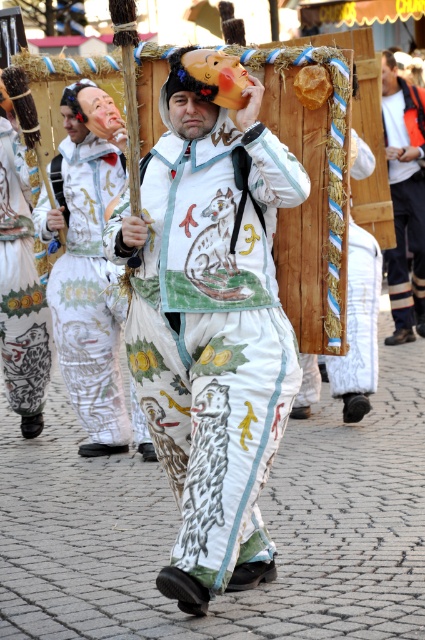
Question: Does orange reflective jacket at upper right appear over matte yellow mask at center?

Choices:
 (A) yes
 (B) no

Answer: (A)

Question: Which of the following is the closest to the observer?

Choices:
 (A) matte yellow mask at center
 (B) matte brown mask at upper center
 (C) matte plastic mask at upper center

Answer: (A)

Question: Among these objects, which one is farthest from the camera?

Choices:
 (A) matte brown mask at upper center
 (B) matte yellow mask at center
 (C) matte plastic mask at upper center

Answer: (A)

Question: Does white painted fabric costume at center have a smaller size compared to matte plastic mask at upper center?

Choices:
 (A) yes
 (B) no

Answer: (B)

Question: Is white painted fabric costume at center positioned in front of white painted fabric mask at center?

Choices:
 (A) yes
 (B) no

Answer: (A)

Question: Estimate the real-world distances between objects in this image. Which object is closer to the white painted fabric costume at center?

Choices:
 (A) matte brown mask at upper center
 (B) white painted fabric mask at center

Answer: (B)